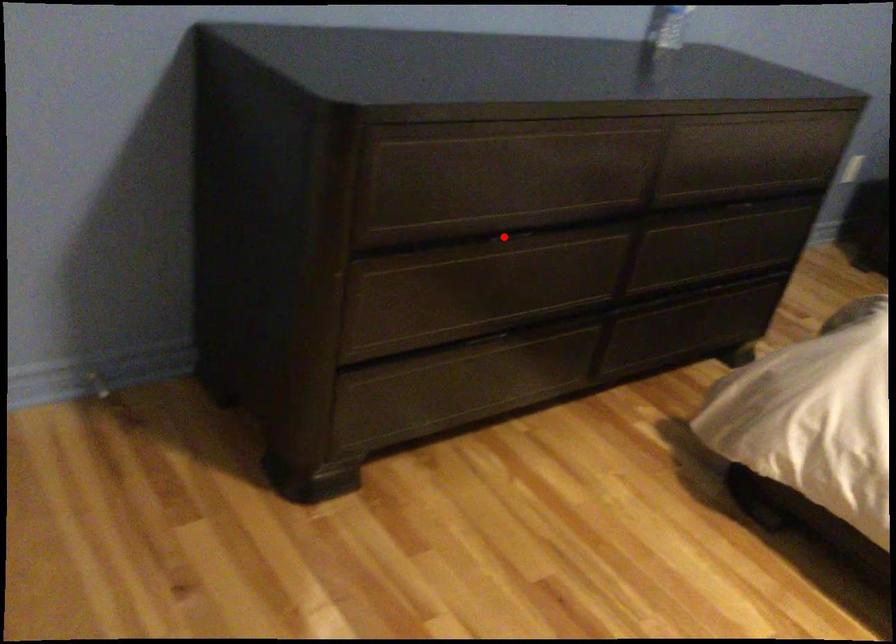
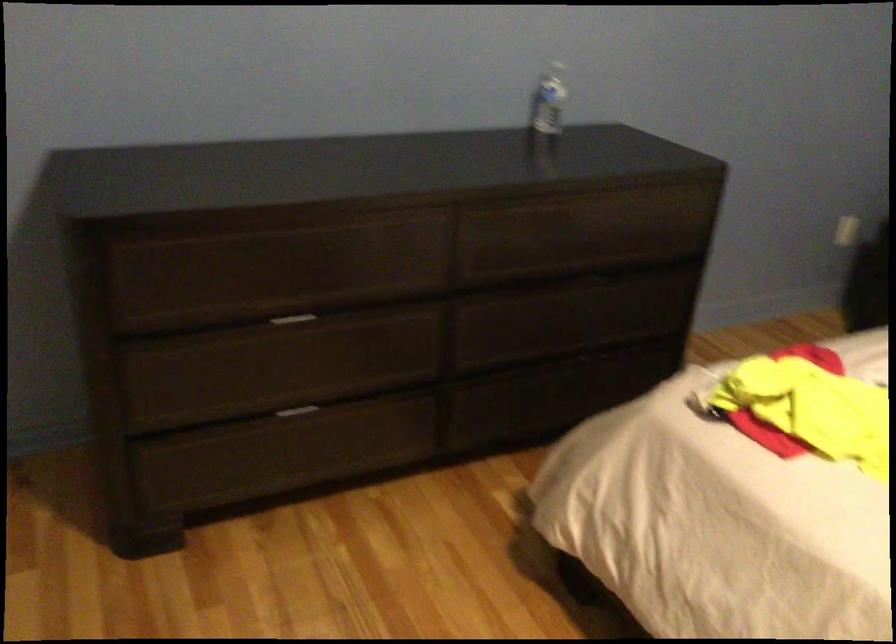
Locate, in the second image, the point that corresponds to the highlighted location in the first image.

(291, 319)